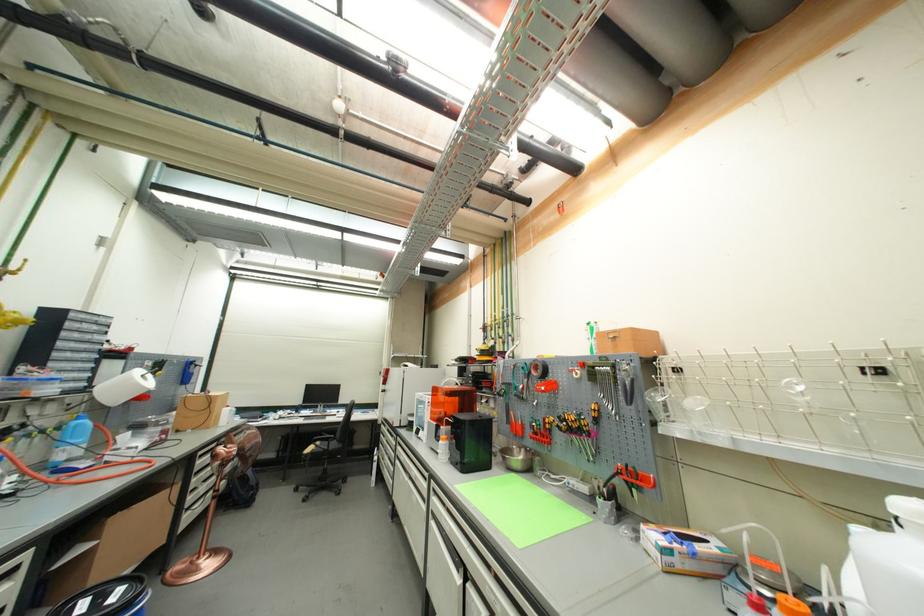
Describe the element at coordinates (107, 598) in the screenshot. I see `the black printer lid` at that location.